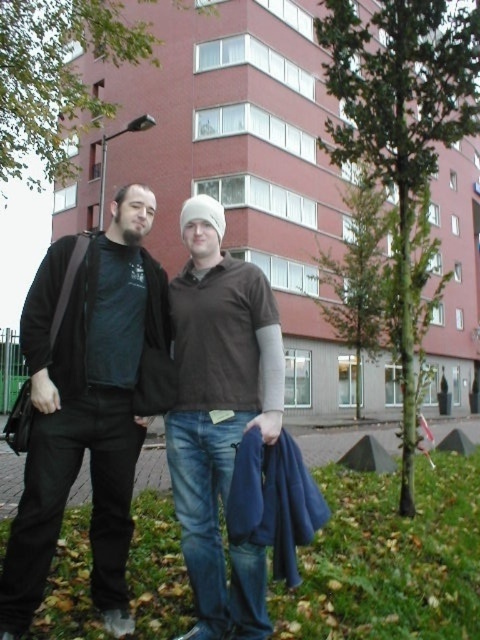
Which is more to the left, black matte jacket at left or brown cotton shirt at center?

black matte jacket at left is more to the left.

Does point (115, 556) lie behind point (248, 586)?

Yes, point (115, 556) is behind point (248, 586).

At what (x,y) coordinates should I click in order to perform the action: click on black matte jacket at left. Please return your answer as a coordinate pair (x, y). This screenshot has height=640, width=480. Looking at the image, I should click on [86, 406].